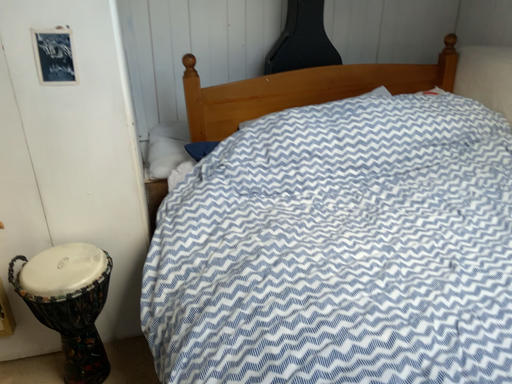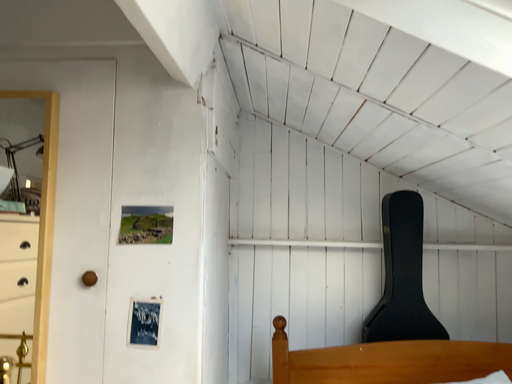
Question: Which way did the camera rotate in the video?

Choices:
 (A) rotated left
 (B) rotated right

Answer: (A)